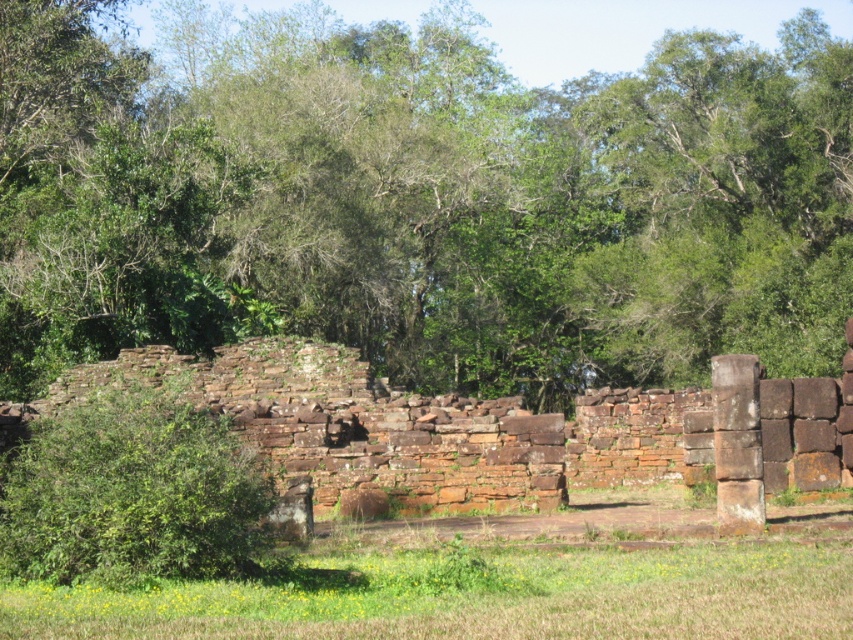
Can you confirm if green leafy tree at center is positioned below brown stone ruins at center?

Incorrect, green leafy tree at center is not positioned below brown stone ruins at center.

Does green leafy tree at center appear over brown stone ruins at center?

Indeed, green leafy tree at center is positioned over brown stone ruins at center.

Is point (607, 269) positioned before point (36, 401)?

No, (607, 269) is behind (36, 401).

Where is `green leafy tree at center`? green leafy tree at center is located at coordinates (419, 198).

The height and width of the screenshot is (640, 853). What do you see at coordinates (486, 432) in the screenshot?
I see `brown stone ruins at center` at bounding box center [486, 432].

Is point (569, 476) less distant than point (189, 499)?

No, (569, 476) is further to viewer.

At what (x,y) coordinates should I click in order to perform the action: click on brown stone ruins at center. Please return your answer as a coordinate pair (x, y). This screenshot has width=853, height=640. Looking at the image, I should click on (486, 432).

Can you confirm if green leafy tree at center is positioned below green grass at lower center?

No.

Describe the element at coordinates (419, 198) in the screenshot. This screenshot has height=640, width=853. I see `green leafy tree at center` at that location.

Who is more distant from viewer, (x=206, y=240) or (x=572, y=557)?

Point (x=206, y=240)

The width and height of the screenshot is (853, 640). Identify the location of green leafy tree at center. (419, 198).